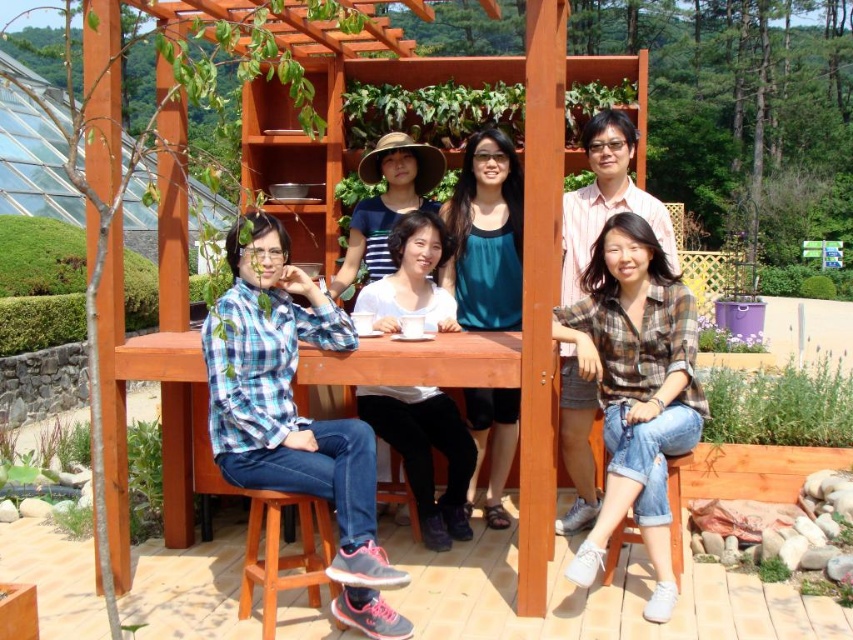
You are a photographer trying to capture a clear shot of the wooden pergola at center and the plaid cotton shirt at center. Based on their positions, which one should you focus on first to ensure both are in focus?

The wooden pergola at center is in front of the plaid cotton shirt at center, so you should focus on the wooden pergola at center first to ensure both are in focus.

You are standing in front of the pergola and notice two points marked on the wooden table. The first point is at coordinate point (419, 433) and the second at point (625, 520). Which point is closer to you?

Point (419, 433) is closer to you because it is further to the camera than point (625, 520).

You are a photographer setting up for a group photo. You have a camera with a lens that can focus on objects up to 2 meters wide. The wooden pergola at center and the plaid cotton shirt at center are both in your frame. Based on their widths, will the lens be able to focus on both objects simultaneously?

The wooden pergola at center is thinner than the plaid cotton shirt at center. Since the lens can focus on objects up to 2 meters wide, and the widest object here is the plaid cotton shirt at center, the lens should be able to focus on both objects as long as their individual widths are within the 2 meter limit. However, the exact widths are not provided, so we can only confirm that the plaid cotton shirt at center is wider than the pergola, but not if either exceeds 2 meters.